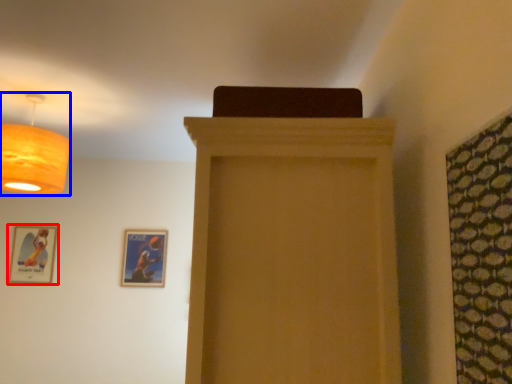
Question: Which of the following is the closest to the observer, picture frame (highlighted by a red box) or lamp (highlighted by a blue box)?

Choices:
 (A) picture frame
 (B) lamp

Answer: (B)